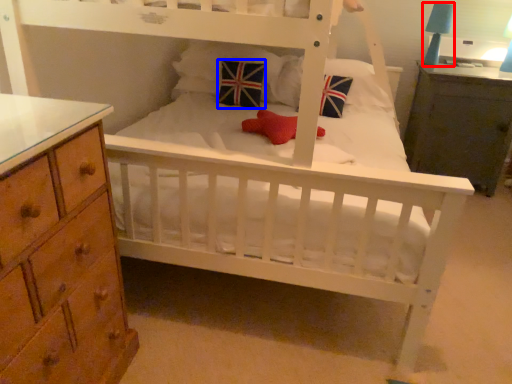
Question: Which object appears closest to the camera in this image, table lamp (highlighted by a red box) or throw pillow (highlighted by a blue box)?

Choices:
 (A) table lamp
 (B) throw pillow

Answer: (B)